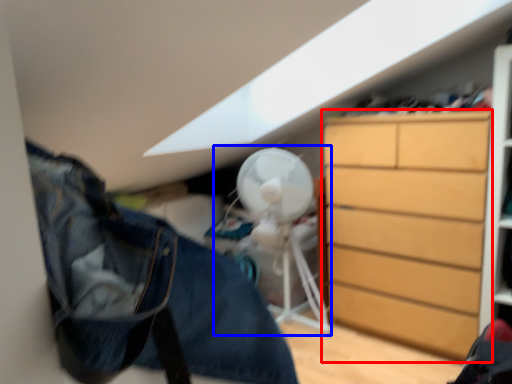
Question: Among these objects, which one is nearest to the camera, chest of drawers (highlighted by a red box) or mechanical fan (highlighted by a blue box)?

Choices:
 (A) chest of drawers
 (B) mechanical fan

Answer: (A)